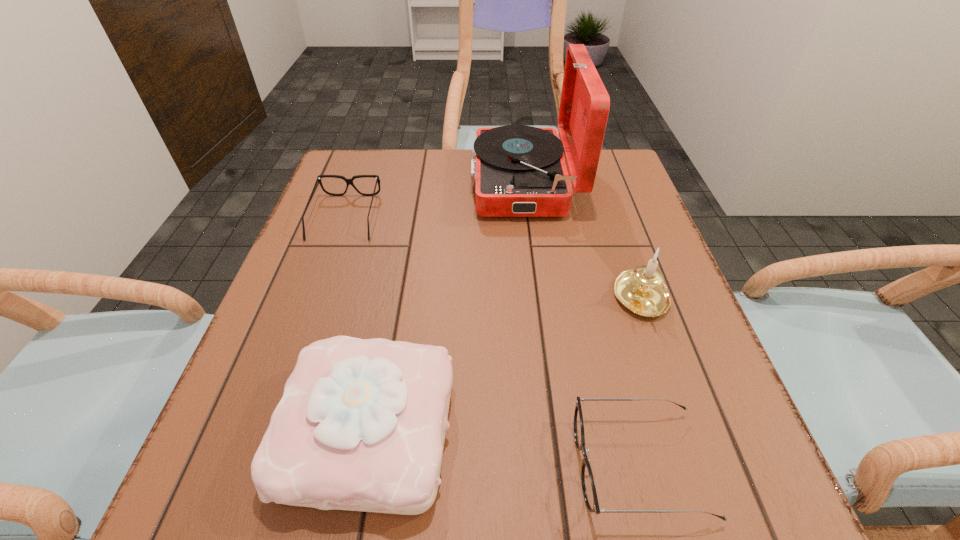
Identify the location of empty space that is in between the tallest object and the third nearest object. The height and width of the screenshot is (540, 960). (583, 241).

Find the location of `vacant space that is in between the third tallest object and the third farthest object`. vacant space that is in between the third tallest object and the third farthest object is located at coordinates (506, 365).

You are a GUI agent. You are given a task and a screenshot of the screen. Output one action in this format:
    pyautogui.click(x=<x>, y=<y>)
    Task: Click on the free space between the cake and the farther spectacles
    
    Given the screenshot: What is the action you would take?
    pyautogui.click(x=357, y=323)

Identify which object is the nearest to the phonograph_record. Please provide its 2D coordinates. Your answer should be formatted as a tuple, i.e. [(x, y)], where the tuple contains the x and y coordinates of a point satisfying the conditions above.

[(641, 290)]

You are a GUI agent. You are given a task and a screenshot of the screen. Output one action in this format:
    pyautogui.click(x=<x>, y=<y>)
    Task: Click on the object that is the closest to the right spectacles
    This screenshot has height=540, width=960.
    Given the screenshot: What is the action you would take?
    pyautogui.click(x=641, y=290)

At what (x,y) coordinates should I click in order to perform the action: click on vacant space that satisfies the following two spatial constraints: 1. with the lenses facing outward on the farther spectacles; 2. on the left side of the cake. Please return your answer as a coordinate pair (x, y). Image resolution: width=960 pixels, height=540 pixels. Looking at the image, I should click on (271, 429).